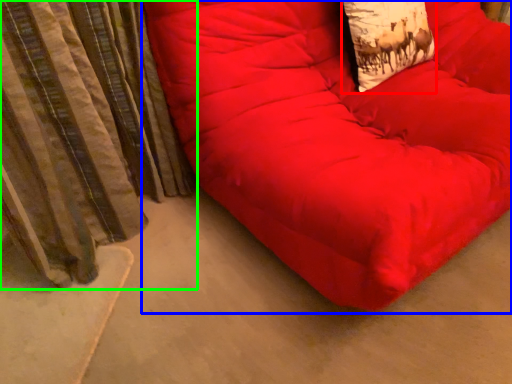
Question: Which object is the closest to the throw pillow (highlighted by a red box)? Choose among these: furniture (highlighted by a blue box) or curtain (highlighted by a green box).

Choices:
 (A) furniture
 (B) curtain

Answer: (A)